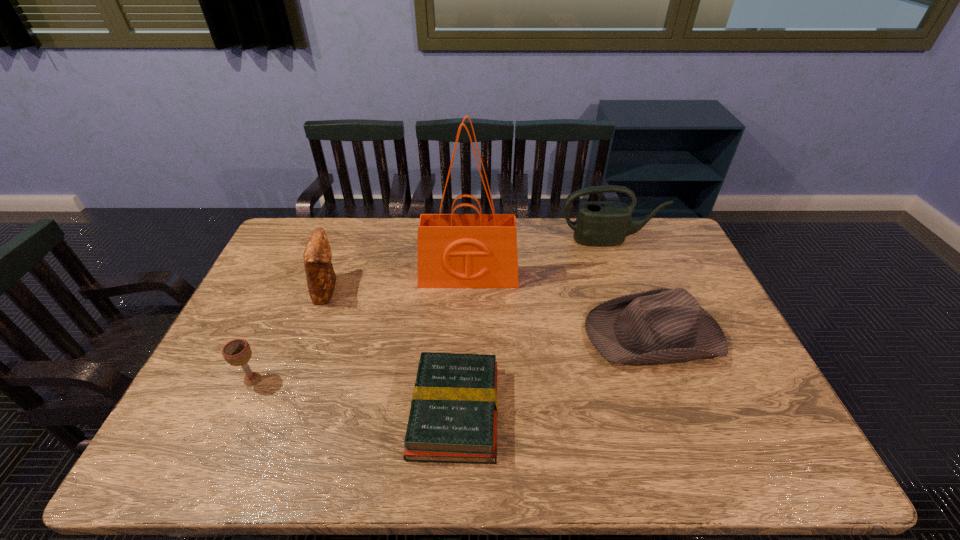
At what (x,y) coordinates should I click in order to perform the action: click on vacant point that satisfies the following two spatial constraints: 1. on the open side of the clutch bag; 2. on the right side of the hardback book. Please return your answer as a coordinate pair (x, y). The width and height of the screenshot is (960, 540). Looking at the image, I should click on (282, 411).

Locate an element on the screen. The height and width of the screenshot is (540, 960). blank space that satisfies the following two spatial constraints: 1. on the open side of the clutch bag; 2. on the back side of the hardback book is located at coordinates (282, 411).

You are a GUI agent. You are given a task and a screenshot of the screen. Output one action in this format:
    pyautogui.click(x=<x>, y=<y>)
    Task: Click on the vacant region that satisfies the following two spatial constraints: 1. on the open side of the clutch bag; 2. on the right side of the hardback book
    
    Given the screenshot: What is the action you would take?
    pyautogui.click(x=282, y=411)

This screenshot has height=540, width=960. Find the location of `free point that satisfies the following two spatial constraints: 1. on the logo side of the tote bag; 2. on the open side of the clutch bag`. free point that satisfies the following two spatial constraints: 1. on the logo side of the tote bag; 2. on the open side of the clutch bag is located at coordinates (468, 289).

Where is `vacant position in the image that satisfies the following two spatial constraints: 1. on the open side of the fifth object from right to left; 2. on the left side of the fedora`? This screenshot has width=960, height=540. vacant position in the image that satisfies the following two spatial constraints: 1. on the open side of the fifth object from right to left; 2. on the left side of the fedora is located at coordinates (311, 333).